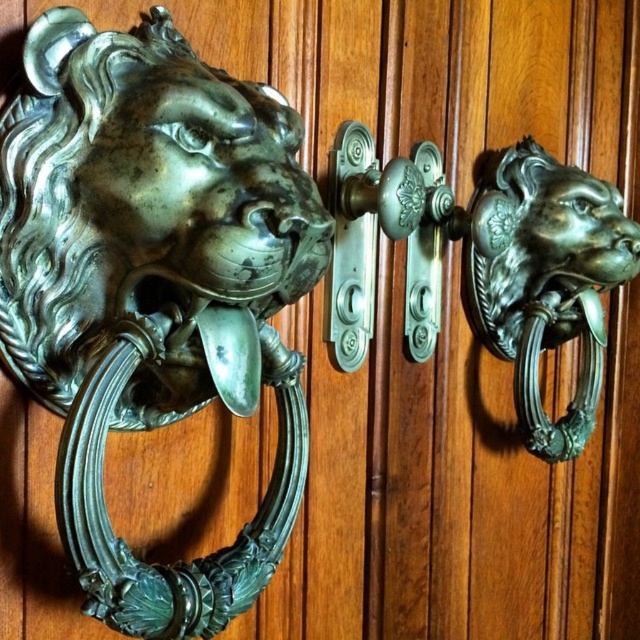
Question: Which of the following is the farthest from the observer?

Choices:
 (A) green patina metal lion head at left
 (B) green patina metal lion head knocker at left

Answer: (A)

Question: Among these objects, which one is farthest from the camera?

Choices:
 (A) green patina metal lion head at left
 (B) green patina metal lion head knocker at left

Answer: (A)

Question: Can you confirm if green patina metal lion head at left is positioned below green patina metal lion head knocker at left?

Choices:
 (A) no
 (B) yes

Answer: (A)

Question: Can you confirm if green patina metal lion head at left is positioned to the right of green patina metal lion head knocker at left?

Choices:
 (A) yes
 (B) no

Answer: (B)

Question: Can you confirm if green patina metal lion head at left is positioned to the left of green patina metal lion head knocker at left?

Choices:
 (A) no
 (B) yes

Answer: (B)

Question: Which object appears farthest from the camera in this image?

Choices:
 (A) green patina metal lion head at left
 (B) green patina metal lion head knocker at left

Answer: (A)